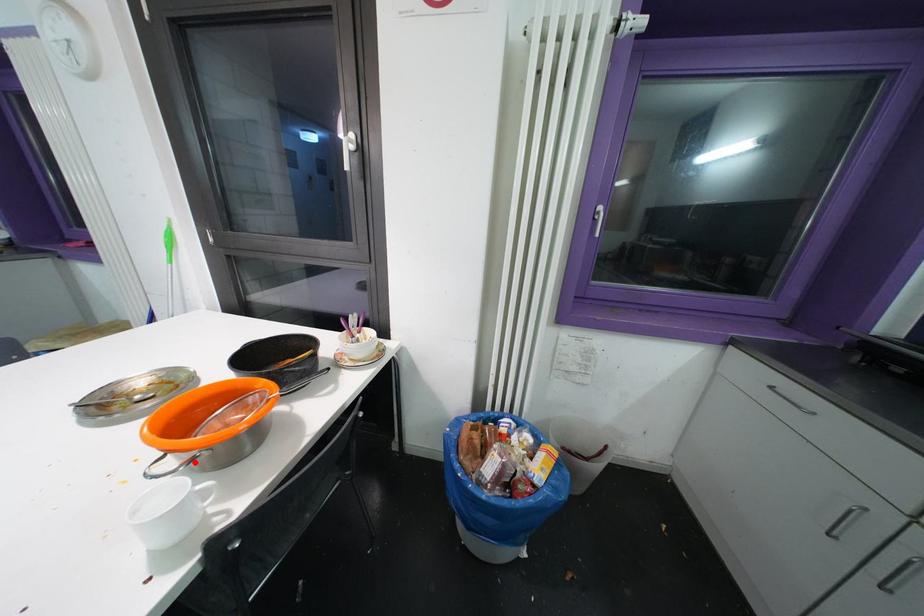
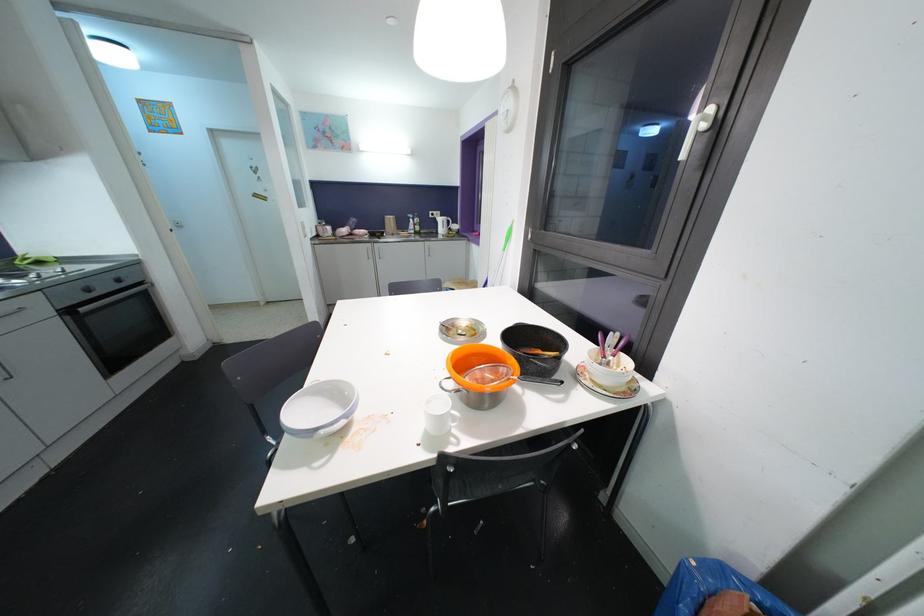
Find the pixel in the second image that matches the highlighted location in the first image.

(460, 392)